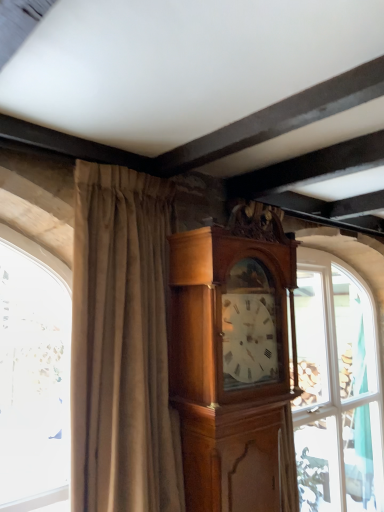
Question: Looking at the image, does polished wood grandfather clock at center seem bigger or smaller compared to clear glass window at center?

Choices:
 (A) small
 (B) big

Answer: (A)

Question: Considering their positions, is polished wood grandfather clock at center located in front of or behind clear glass window at center?

Choices:
 (A) behind
 (B) front

Answer: (B)

Question: Considering the real-world distances, which object is farthest from the clear glass window at center?

Choices:
 (A) beige velvet curtain at center
 (B) polished wood grandfather clock at center

Answer: (A)

Question: Which object is positioned closest to the beige velvet curtain at center?

Choices:
 (A) polished wood grandfather clock at center
 (B) clear glass window at center

Answer: (A)